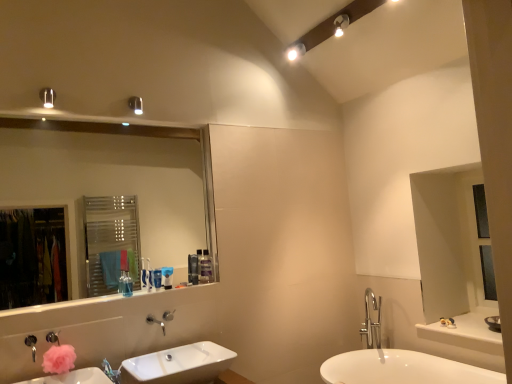
You are a GUI agent. You are given a task and a screenshot of the screen. Output one action in this format:
    pyautogui.click(x=<x>, y=<y>)
    Task: Click on the blank space situated above white glossy sink at lower center, which appears as the 2th sink when viewed from the left (from a real-world perspective)
    
    Given the screenshot: What is the action you would take?
    pyautogui.click(x=166, y=364)